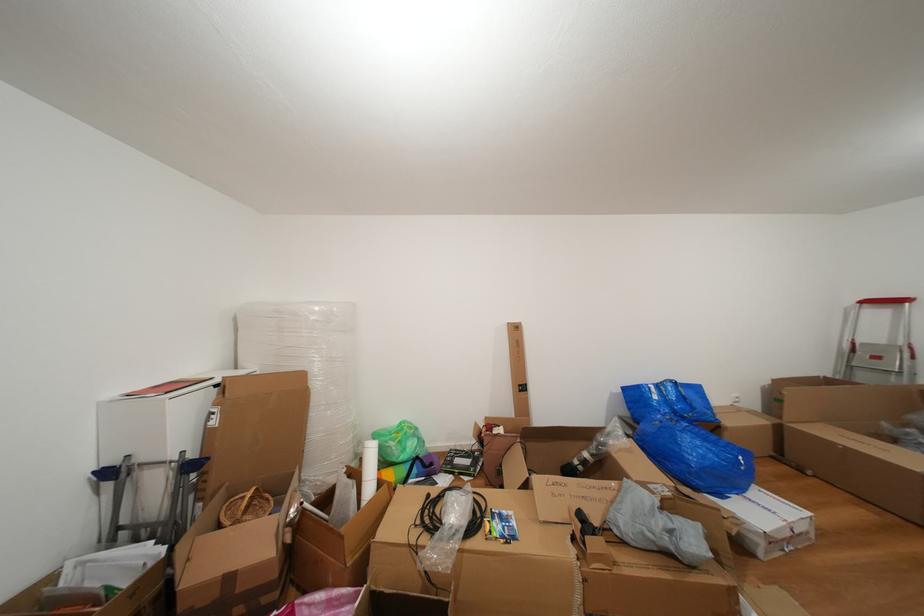
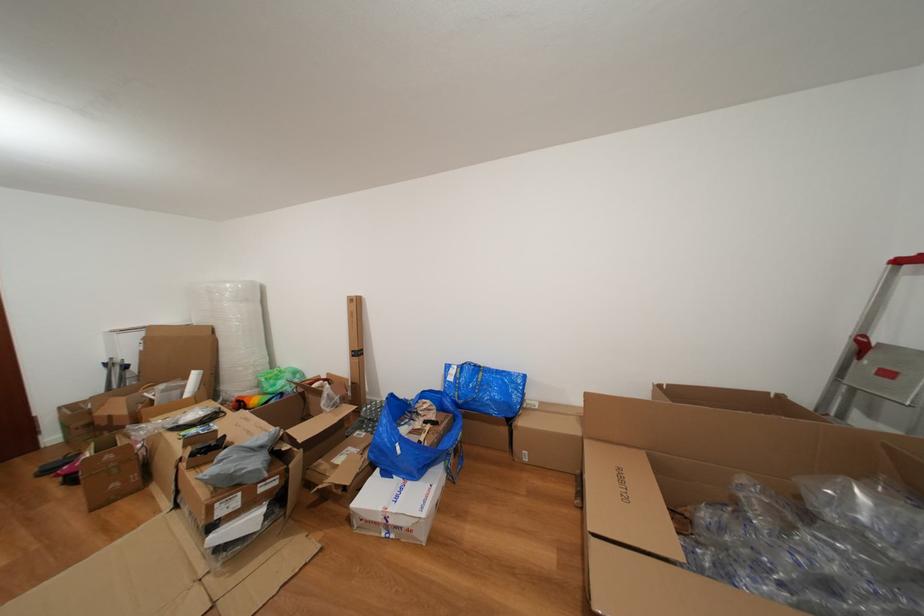
The point at (728,500) is marked in the first image. Where is the corresponding point in the second image?

(394, 479)